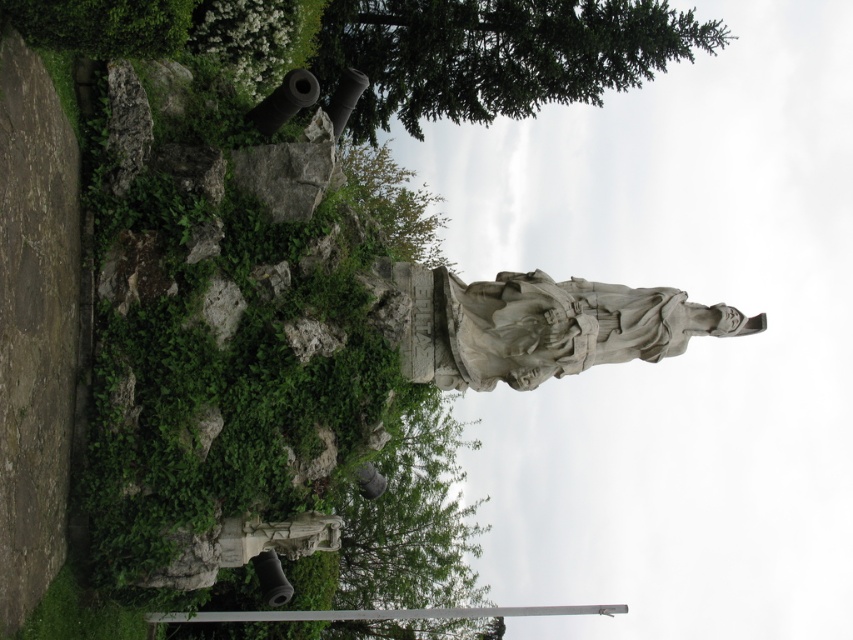
Who is more distant from viewer, (602, 58) or (566, 284)?

The point (602, 58) is more distant.

The height and width of the screenshot is (640, 853). In order to click on green leafy tree at upper center in this screenshot , I will do `click(495, 54)`.

I want to click on green leafy tree at upper center, so click(x=495, y=54).